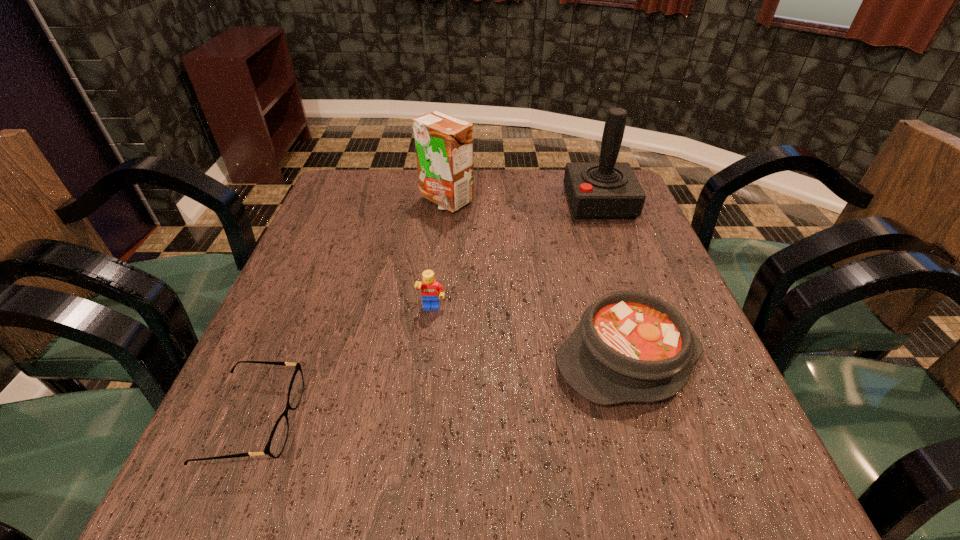
At what (x,y) coordinates should I click in order to perform the action: click on object situated at the far right corner. Please return your answer as a coordinate pair (x, y). This screenshot has width=960, height=540. Looking at the image, I should click on pyautogui.click(x=607, y=189).

Where is `vacant space at the far edge`? This screenshot has height=540, width=960. vacant space at the far edge is located at coordinates (475, 197).

The height and width of the screenshot is (540, 960). In the image, there is a desktop. What are the coordinates of `vacant space at the near edge` in the screenshot? It's located at (630, 487).

What are the coordinates of `free location at the left edge of the desktop` in the screenshot? It's located at (302, 308).

This screenshot has width=960, height=540. In order to click on vacant space at the far left corner in this screenshot , I will do `click(358, 211)`.

In order to click on blank space at the near left corner in this screenshot , I will do `click(234, 483)`.

Identify the location of empty space that is in between the leftmost object and the carton. [349, 311].

At what (x,y) coordinates should I click in order to perform the action: click on free spot between the carton and the casserole. Please return your answer as a coordinate pair (x, y). Image resolution: width=960 pixels, height=540 pixels. Looking at the image, I should click on (537, 280).

Identify the location of unoccupied area between the carton and the joystick. This screenshot has width=960, height=540. (522, 201).

The width and height of the screenshot is (960, 540). I want to click on vacant region between the joystick and the spectacles, so click(x=426, y=312).